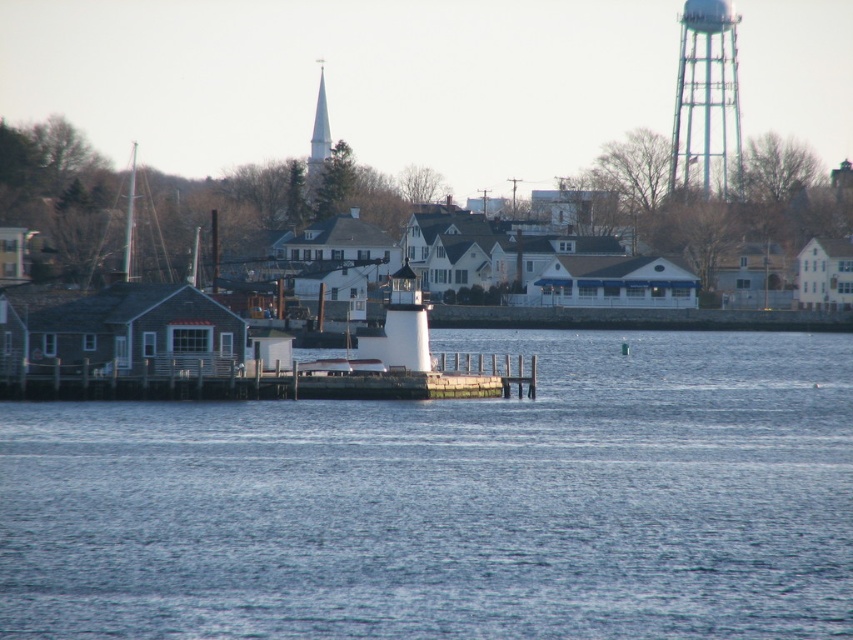
Between white wooden dock at center and metallic lattice tower at upper right, which one has more height?

With more height is metallic lattice tower at upper right.

Which is in front, point (477, 381) or point (714, 86)?

Point (477, 381) is in front.

Which is behind, point (444, 378) or point (701, 93)?

The point (701, 93) is more distant.

Where is `white wooden dock at center`? The height and width of the screenshot is (640, 853). white wooden dock at center is located at coordinates (277, 381).

Is white wooden dock at center positioned behind white steeple at upper center?

That is False.

Which of these two, white wooden dock at center or white steeple at upper center, stands taller?

white steeple at upper center is taller.

Which is in front, point (148, 369) or point (322, 154)?

Point (148, 369)

The height and width of the screenshot is (640, 853). What are the coordinates of `white wooden dock at center` in the screenshot? It's located at (277, 381).

Is white wooden dock at center shorter than white matte water tower at center?

Correct, white wooden dock at center is not as tall as white matte water tower at center.

The image size is (853, 640). What do you see at coordinates (277, 381) in the screenshot? I see `white wooden dock at center` at bounding box center [277, 381].

Locate an element on the screen. The height and width of the screenshot is (640, 853). white wooden dock at center is located at coordinates point(277,381).